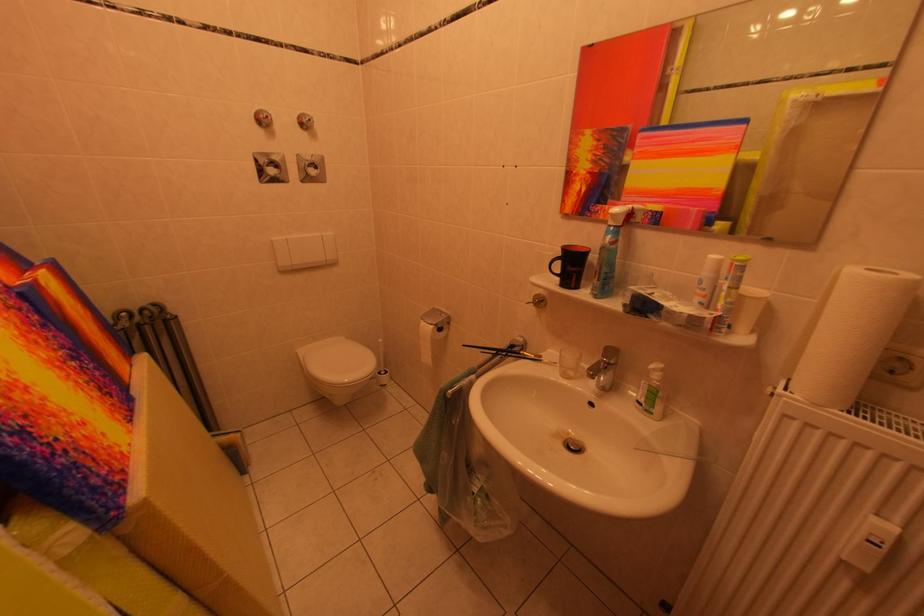
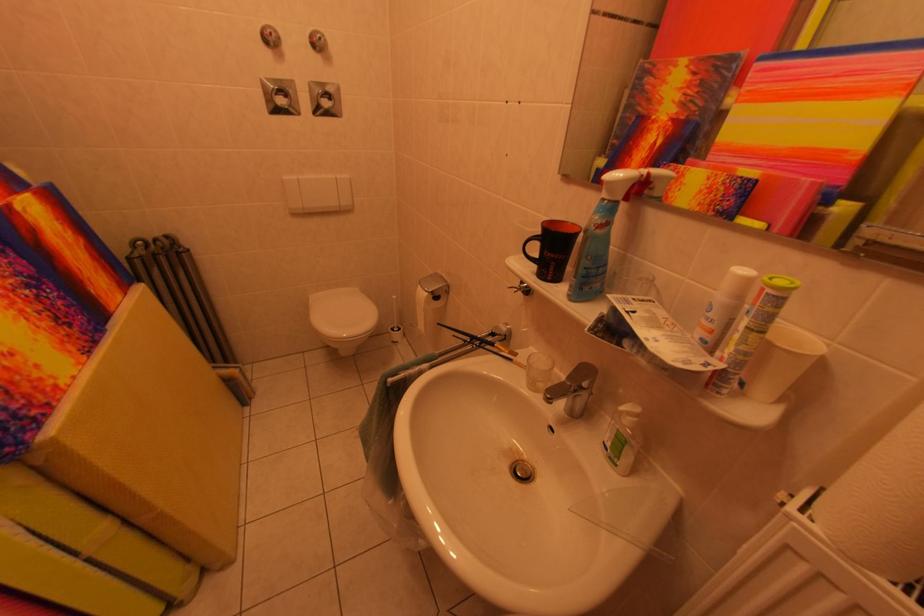
In the second image, find the point that corresponds to [432,328] in the first image.

(429, 292)